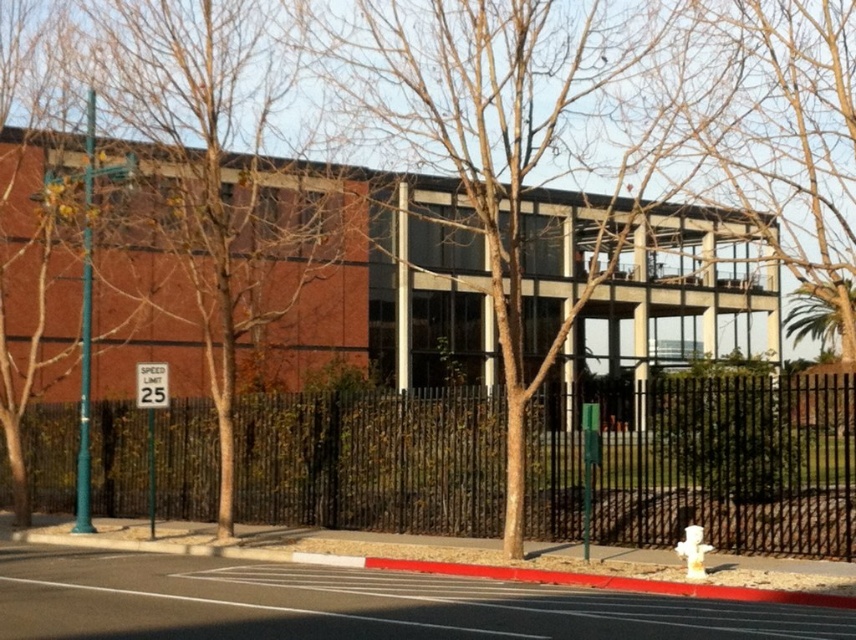
Can you confirm if bare wood tree at center is shorter than white plastic hydrant at lower right?

No, bare wood tree at center is not shorter than white plastic hydrant at lower right.

Which is more to the left, bare wood tree at center or white plastic hydrant at lower right?

Positioned to the left is bare wood tree at center.

Which is in front, point (651, 205) or point (700, 531)?

Point (700, 531)

Locate an element on the screen. Image resolution: width=856 pixels, height=640 pixels. bare wood tree at center is located at coordinates (527, 128).

Which is behind, point (486, 492) or point (704, 579)?

The point (486, 492) is behind.

Where is `black metal fence at center`? black metal fence at center is located at coordinates (730, 465).

Image resolution: width=856 pixels, height=640 pixels. I want to click on black metal fence at center, so 730,465.

Can you confirm if black metal fence at center is thinner than bare wood tree at center?

No.

Which is behind, point (664, 460) or point (498, 150)?

The point (498, 150) is behind.

At what (x,y) coordinates should I click in order to perform the action: click on black metal fence at center. Please return your answer as a coordinate pair (x, y). Looking at the image, I should click on (730, 465).